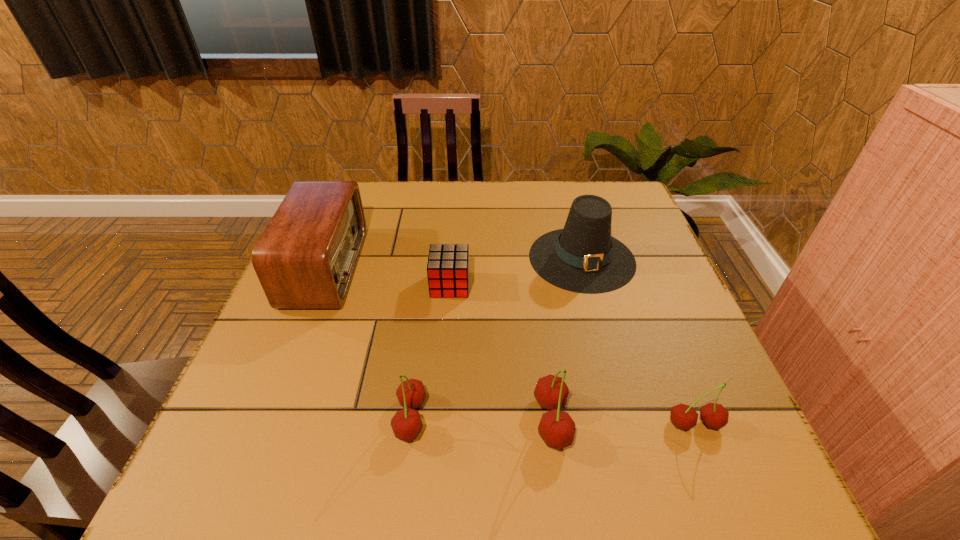
Where is `free space that satisfies the following two spatial constraints: 1. on the front side of the shortest object; 2. on the surface of the second tallest cherry`? free space that satisfies the following two spatial constraints: 1. on the front side of the shortest object; 2. on the surface of the second tallest cherry is located at coordinates (441, 418).